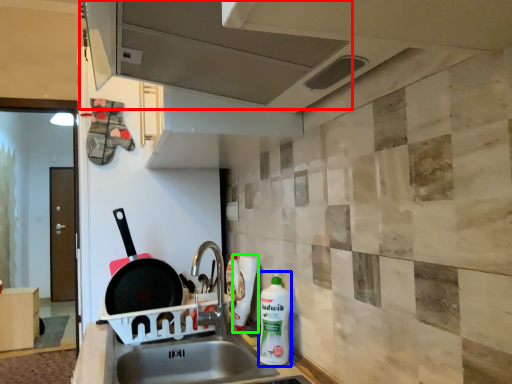
Question: Which object is the closest to the exhaust hood (highlighted by a red box)? Choose among these: cleaning product (highlighted by a blue box) or bottle (highlighted by a green box).

Choices:
 (A) cleaning product
 (B) bottle

Answer: (A)